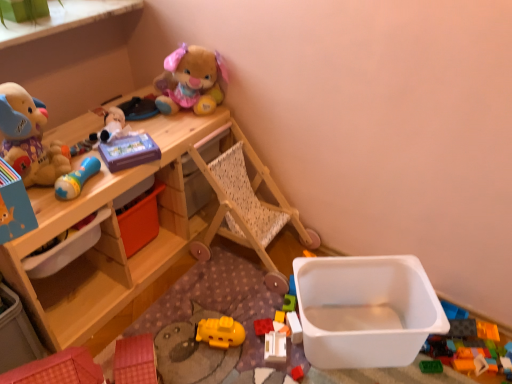
Locate an element on the screen. The height and width of the screenshot is (384, 512). vacant area that is in front of blue rubber rattle at upper left, the sixth toy ordered from the bottom is located at coordinates (55, 212).